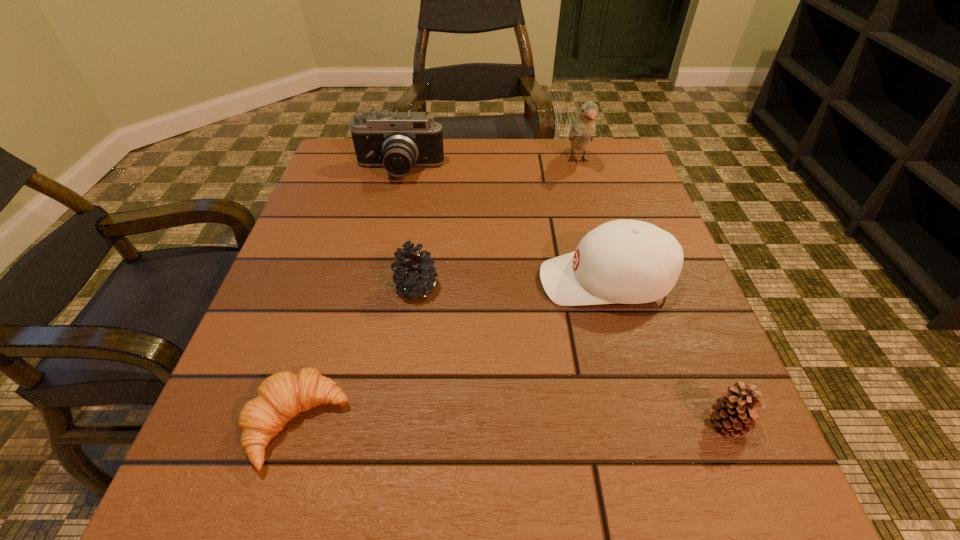
The image size is (960, 540). What are the coordinates of `the tallest object` in the screenshot? It's located at (583, 130).

Identify the location of camera. This screenshot has width=960, height=540. (397, 141).

I want to click on baseball cap, so click(623, 261).

Image resolution: width=960 pixels, height=540 pixels. Identify the location of the taller pinecone. (414, 271).

Locate an element on the screen. The image size is (960, 540). the farther pinecone is located at coordinates (414, 271).

Locate an element on the screen. The height and width of the screenshot is (540, 960). the shorter pinecone is located at coordinates (734, 412).

Locate an element on the screen. The image size is (960, 540). the nearer pinecone is located at coordinates (734, 412).

Find the location of a particular element. This screenshot has width=960, height=540. crescent roll is located at coordinates (282, 396).

Where is `vacant area situated at the face of the bird`? The height and width of the screenshot is (540, 960). vacant area situated at the face of the bird is located at coordinates (587, 192).

Locate an element on the screen. vacant point located 0.250m on the front-facing side of the camera is located at coordinates (379, 259).